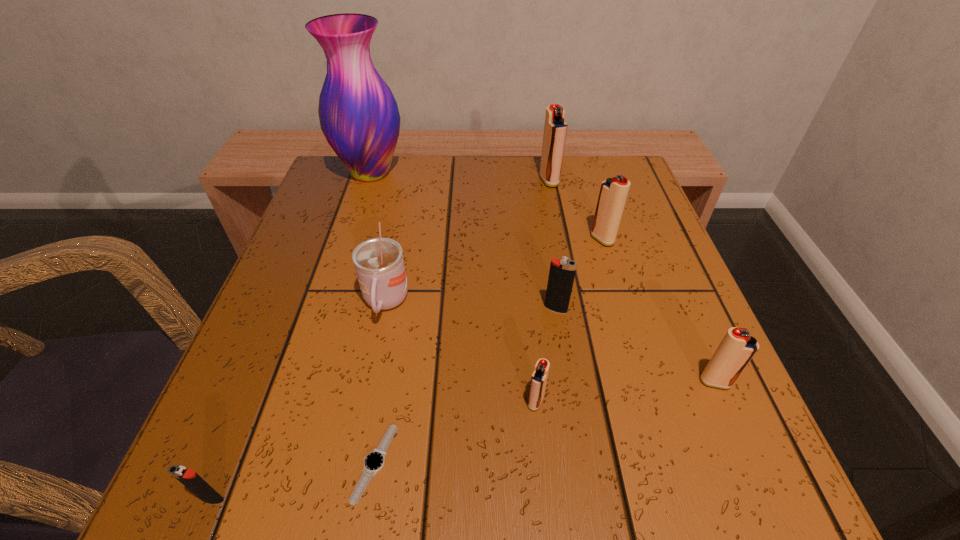
Find the location of a particular element. free point located on the front of the fourth nearest igniter is located at coordinates (568, 385).

Identify the location of vacant region located on the left of the third nearest igniter. This screenshot has height=540, width=960. (443, 382).

At what (x,y) coordinates should I click in order to perform the action: click on vacant point located 0.300m on the left of the nearest red igniter. Please return your answer as a coordinate pair (x, y). Looking at the image, I should click on (322, 402).

This screenshot has width=960, height=540. Identify the location of vacant area situated on the right of the nearest igniter. [466, 499].

Where is `free region located on the left of the watch`? This screenshot has width=960, height=540. free region located on the left of the watch is located at coordinates (280, 463).

Where is `vase positioned at the far edge`? This screenshot has width=960, height=540. vase positioned at the far edge is located at coordinates (359, 117).

This screenshot has height=540, width=960. What are the coordinates of `igniter positioned at the far edge` in the screenshot? It's located at (555, 128).

Locate an element on the screen. igniter at the near edge is located at coordinates (189, 478).

Identify the location of watch situated at the near edge. (374, 461).

The width and height of the screenshot is (960, 540). I want to click on vase located at the left edge, so click(x=359, y=117).